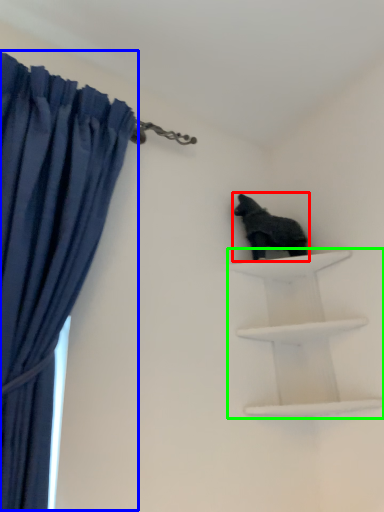
Question: Considering the real-world distances, which object is farthest from animal (highlighted by a red box)? curtain (highlighted by a blue box) or shelf (highlighted by a green box)?

Choices:
 (A) curtain
 (B) shelf

Answer: (A)